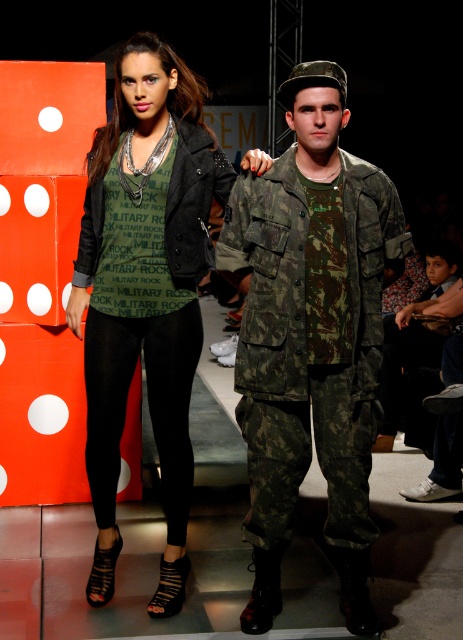
From the picture: Can you confirm if camo fabric uniform at center is smaller than matte black leggings at center?

No, camo fabric uniform at center is not smaller than matte black leggings at center.

Looking at this image, how distant is camo fabric uniform at center from matte black leggings at center?

44.51 centimeters

Where is `camo fabric uniform at center`? camo fabric uniform at center is located at coordinates (311, 337).